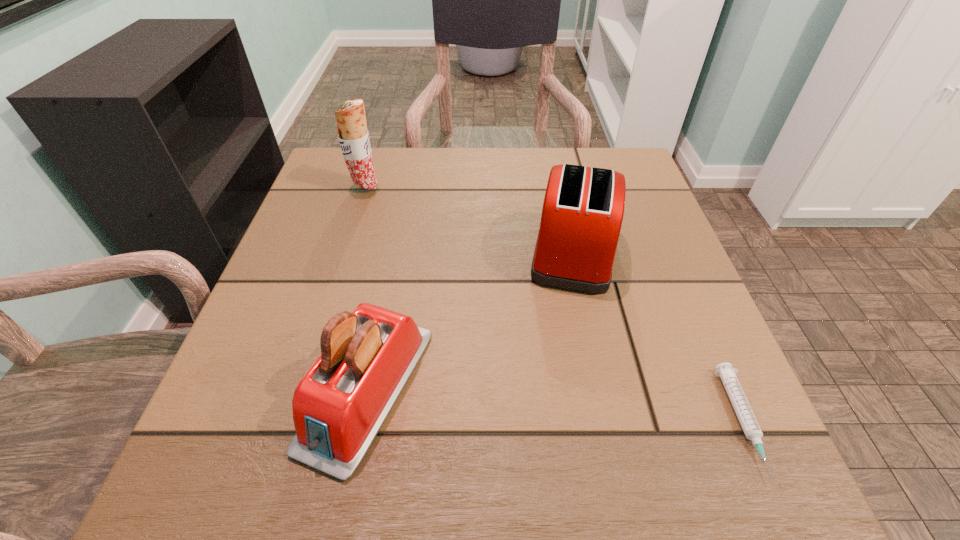
Where is `the tallest object`? The image size is (960, 540). the tallest object is located at coordinates (353, 136).

Find the location of `burrito`. burrito is located at coordinates (353, 136).

In order to click on the second object from right to left in this screenshot , I will do `click(583, 208)`.

I want to click on the farther toaster, so click(x=583, y=208).

The height and width of the screenshot is (540, 960). Find the location of `the nearer toaster`. the nearer toaster is located at coordinates (367, 356).

Where is `syringe`? syringe is located at coordinates (749, 424).

Where is `the rightmost object`? Image resolution: width=960 pixels, height=540 pixels. the rightmost object is located at coordinates (749, 424).

Where is `vacant space located on the front of the burrito`? vacant space located on the front of the burrito is located at coordinates (333, 289).

In order to click on vacant position located 0.270m on the front of the farther toaster in this screenshot , I will do `click(614, 445)`.

What are the coordinates of `free space located 0.380m on the back of the left toaster` in the screenshot? It's located at (407, 190).